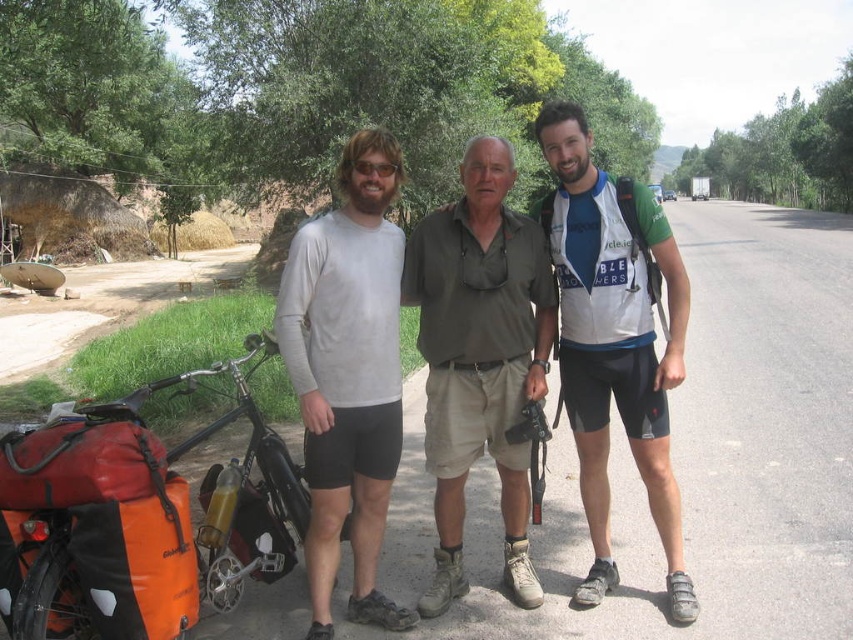
Based on the photo, how distant is matte white shirt at center from white mesh shirt at center?

matte white shirt at center is 3.18 inches from white mesh shirt at center.

Is the position of matte white shirt at center more distant than that of white mesh shirt at center?

No.

Which is in front, point (604, 321) or point (670, 545)?

Positioned in front is point (604, 321).

The width and height of the screenshot is (853, 640). I want to click on matte white shirt at center, so click(x=614, y=339).

Can you confirm if white long-sleeved shirt at center is taller than khaki cotton shirt at center?

Yes.

Is point (355, 618) closer to camera compared to point (508, 448)?

That is True.

Find the location of `white long-sleeved shirt at center`. white long-sleeved shirt at center is located at coordinates (347, 374).

Between white long-sleeved shirt at center and white mesh shirt at center, which one has less height?

white long-sleeved shirt at center

Is point (358, 548) positioned in front of point (664, 410)?

Yes, it is.

Locate an element on the screen. Image resolution: width=853 pixels, height=640 pixels. white long-sleeved shirt at center is located at coordinates (347, 374).